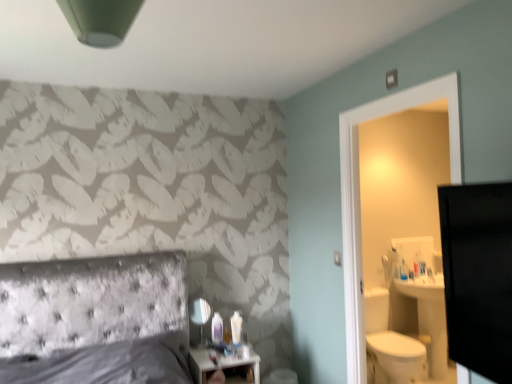
Question: Is white plastic lotion at center smaller than white glossy nightstand at lower center?

Choices:
 (A) no
 (B) yes

Answer: (B)

Question: Is white plastic lotion at center thinner than white glossy nightstand at lower center?

Choices:
 (A) no
 (B) yes

Answer: (B)

Question: Is white plastic lotion at center oriented towards white glossy nightstand at lower center?

Choices:
 (A) no
 (B) yes

Answer: (A)

Question: Is white plastic lotion at center not inside white glossy nightstand at lower center?

Choices:
 (A) no
 (B) yes

Answer: (B)

Question: Are white plastic lotion at center and white glossy nightstand at lower center making contact?

Choices:
 (A) no
 (B) yes

Answer: (A)

Question: Considering the positions of point (201, 324) and point (257, 364), is point (201, 324) closer or farther from the camera than point (257, 364)?

Choices:
 (A) closer
 (B) farther

Answer: (A)

Question: From a real-world perspective, is matte glass mirror at center positioned above or below white glossy nightstand at lower center?

Choices:
 (A) above
 (B) below

Answer: (A)

Question: Relative to white glossy nightstand at lower center, is matte glass mirror at center in front or behind?

Choices:
 (A) front
 (B) behind

Answer: (B)

Question: Considering the relative positions of matte glass mirror at center and white glossy nightstand at lower center in the image provided, is matte glass mirror at center to the left or to the right of white glossy nightstand at lower center?

Choices:
 (A) right
 (B) left

Answer: (B)

Question: Does point (202, 311) appear closer or farther from the camera than point (231, 339)?

Choices:
 (A) closer
 (B) farther

Answer: (A)

Question: Is matte glass mirror at center bigger or smaller than white plastic lotion at center?

Choices:
 (A) big
 (B) small

Answer: (A)

Question: In the image, is matte glass mirror at center on the left side or the right side of white plastic lotion at center?

Choices:
 (A) left
 (B) right

Answer: (A)

Question: From a real-world perspective, is matte glass mirror at center above or below white plastic lotion at center?

Choices:
 (A) below
 (B) above

Answer: (B)

Question: From their relative heights in the image, would you say white glossy nightstand at lower center is taller or shorter than white plastic lotion at center?

Choices:
 (A) tall
 (B) short

Answer: (A)

Question: From a real-world perspective, is white glossy nightstand at lower center above or below white plastic lotion at center?

Choices:
 (A) below
 (B) above

Answer: (A)